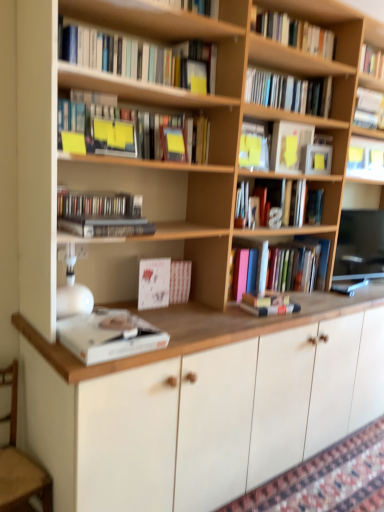
Question: From the image's perspective, is wooden armchair at lower left below matte yellow sticky notes at upper center, the 7th book ordered from the bottom?

Choices:
 (A) yes
 (B) no

Answer: (A)

Question: From the image's perspective, is wooden armchair at lower left over matte yellow sticky notes at upper center, the 7th book ordered from the bottom?

Choices:
 (A) no
 (B) yes

Answer: (A)

Question: Could matte yellow sticky notes at upper center, marked as the 6th book in a top-to-bottom arrangement, be considered to be inside wooden armchair at lower left?

Choices:
 (A) yes
 (B) no

Answer: (B)

Question: Can you confirm if wooden armchair at lower left is bigger than matte yellow sticky notes at upper center, the 7th book ordered from the bottom?

Choices:
 (A) no
 (B) yes

Answer: (B)

Question: Does wooden armchair at lower left appear on the right side of matte yellow sticky notes at upper center, the 7th book ordered from the bottom?

Choices:
 (A) yes
 (B) no

Answer: (B)

Question: Could you tell me if wooden armchair at lower left is facing matte yellow sticky notes at upper center, marked as the 6th book in a top-to-bottom arrangement?

Choices:
 (A) no
 (B) yes

Answer: (A)

Question: From the image's perspective, does hardcover books at upper right, which ranks as the eleventh book in bottom-to-top order, appear higher than hardcover book at upper right, the 5th book viewed from the top?

Choices:
 (A) yes
 (B) no

Answer: (A)

Question: Is hardcover books at upper right, placed as the second book when sorted from top to bottom, beside hardcover book at upper right, which is counted as the 8th book, starting from the bottom?

Choices:
 (A) yes
 (B) no

Answer: (B)

Question: From a real-world perspective, is hardcover books at upper right, placed as the second book when sorted from top to bottom, on hardcover book at upper right, the 5th book viewed from the top?

Choices:
 (A) yes
 (B) no

Answer: (A)

Question: Is hardcover books at upper right, placed as the second book when sorted from top to bottom, to the right of hardcover book at upper right, the 5th book viewed from the top, from the viewer's perspective?

Choices:
 (A) yes
 (B) no

Answer: (B)

Question: Can you confirm if hardcover books at upper right, which ranks as the eleventh book in bottom-to-top order, is taller than hardcover book at upper right, which is counted as the 8th book, starting from the bottom?

Choices:
 (A) yes
 (B) no

Answer: (A)

Question: Can you confirm if hardcover books at upper right, placed as the second book when sorted from top to bottom, is positioned to the left of hardcover book at upper right, which is counted as the 8th book, starting from the bottom?

Choices:
 (A) yes
 (B) no

Answer: (A)

Question: Can you confirm if wooden armchair at lower left is positioned to the left of matte black compact disc case at left, acting as the 8th book starting from the top?

Choices:
 (A) no
 (B) yes

Answer: (B)